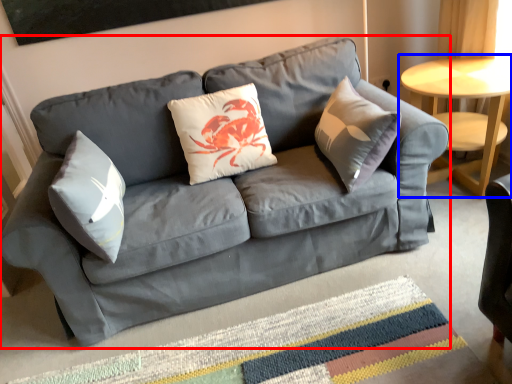
Question: Which object is further to the camera taking this photo, studio couch (highlighted by a red box) or table (highlighted by a blue box)?

Choices:
 (A) studio couch
 (B) table

Answer: (B)